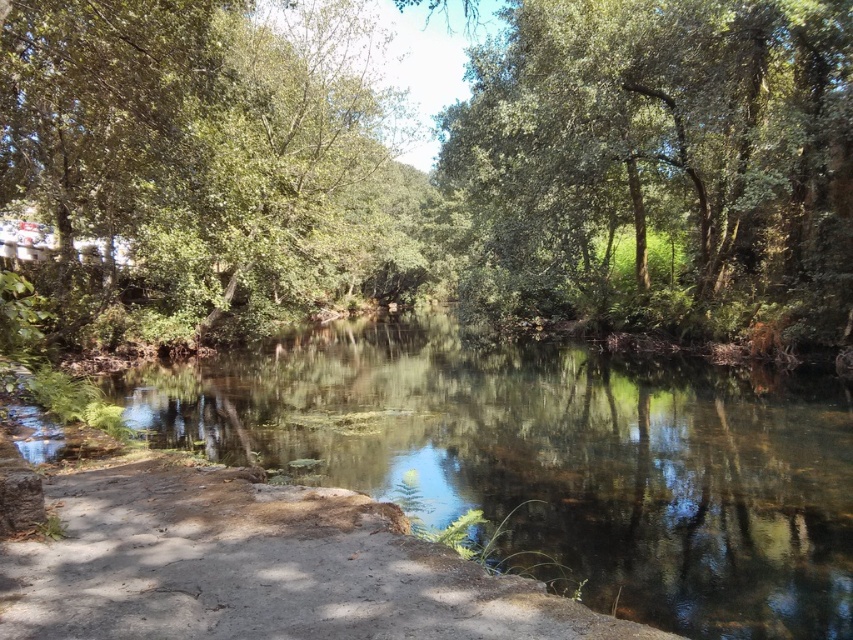
You are a photographer planning to capture the reflection of the green leafy tree at upper center and the dull gray concrete at lower left in the water. Since the water is still, you want to ensure both objects are fully visible in their reflections. Given the scene, which object might have a wider reflection in the water?

The green leafy tree at upper center has a wider reflection in the water because its width surpasses that of the dull gray concrete at lower left.